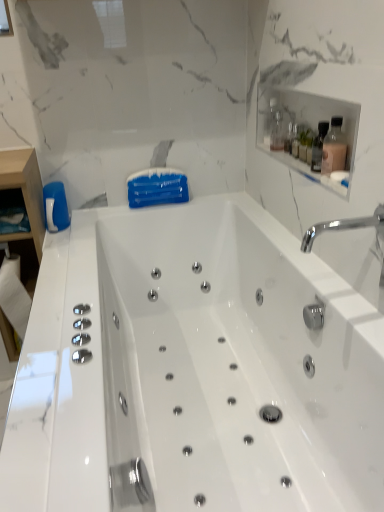
Question: Is clear glass bottle at upper right, the 2th bottle ordered from the bottom, outside white glossy bathtub at center?

Choices:
 (A) yes
 (B) no

Answer: (A)

Question: Is clear glass bottle at upper right, acting as the 1th bottle starting from the back, in contact with white glossy bathtub at center?

Choices:
 (A) no
 (B) yes

Answer: (A)

Question: From a real-world perspective, is clear glass bottle at upper right, positioned as the first bottle in left-to-right order, physically below white glossy bathtub at center?

Choices:
 (A) yes
 (B) no

Answer: (B)

Question: Is the position of clear glass bottle at upper right, the 2th bottle ordered from the bottom, more distant than that of white glossy bathtub at center?

Choices:
 (A) yes
 (B) no

Answer: (A)

Question: Is clear glass bottle at upper right, acting as the 1th bottle starting from the back, positioned in front of white glossy bathtub at center?

Choices:
 (A) no
 (B) yes

Answer: (A)

Question: Looking at the image, does clear glass bottle at upper right, acting as the second bottle starting from the front, seem bigger or smaller compared to chrome metallic faucet at upper right?

Choices:
 (A) big
 (B) small

Answer: (B)

Question: Looking at their shapes, would you say clear glass bottle at upper right, positioned as the first bottle in top-to-bottom order, is wider or thinner than chrome metallic faucet at upper right?

Choices:
 (A) thin
 (B) wide

Answer: (A)

Question: From the image's perspective, relative to chrome metallic faucet at upper right, is clear glass bottle at upper right, positioned as the first bottle in left-to-right order, above or below?

Choices:
 (A) below
 (B) above

Answer: (B)

Question: Is point (283, 147) positioned closer to the camera than point (350, 223)?

Choices:
 (A) farther
 (B) closer

Answer: (A)

Question: Relative to clear glass bottle at upper right, positioned as the first bottle in top-to-bottom order, is chrome metallic faucet at upper right in front or behind?

Choices:
 (A) front
 (B) behind

Answer: (A)

Question: Visually, is chrome metallic faucet at upper right positioned to the left or to the right of clear glass bottle at upper right, acting as the second bottle starting from the front?

Choices:
 (A) right
 (B) left

Answer: (A)

Question: In terms of width, does chrome metallic faucet at upper right look wider or thinner when compared to clear glass bottle at upper right, acting as the 1th bottle starting from the back?

Choices:
 (A) wide
 (B) thin

Answer: (A)

Question: From a real-world perspective, relative to clear glass bottle at upper right, acting as the 1th bottle starting from the back, is chrome metallic faucet at upper right vertically above or below?

Choices:
 (A) below
 (B) above

Answer: (A)

Question: From a real-world perspective, is white glossy bathtub at center above or below chrome metallic faucet at upper right?

Choices:
 (A) below
 (B) above

Answer: (A)

Question: From the image's perspective, is white glossy bathtub at center above or below chrome metallic faucet at upper right?

Choices:
 (A) below
 (B) above

Answer: (A)